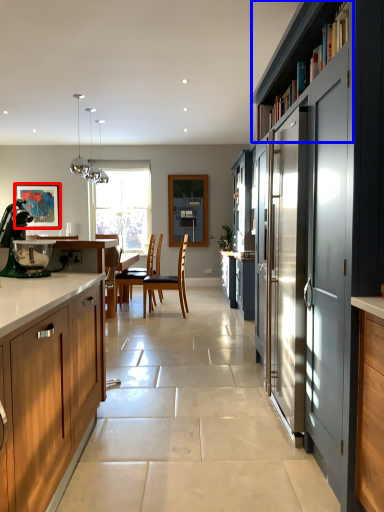
Question: Which object appears farthest to the camera in this image, picture frame (highlighted by a red box) or shelf (highlighted by a blue box)?

Choices:
 (A) picture frame
 (B) shelf

Answer: (A)